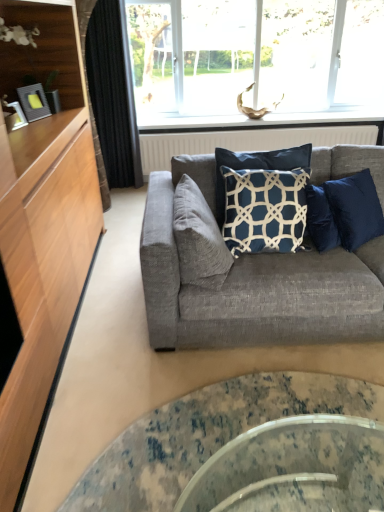
Question: Does black fabric curtain at left appear on the left side of transparent glass window at upper center?

Choices:
 (A) no
 (B) yes

Answer: (B)

Question: From the image's perspective, is black fabric curtain at left located beneath transparent glass window at upper center?

Choices:
 (A) yes
 (B) no

Answer: (A)

Question: From a real-world perspective, is black fabric curtain at left physically above transparent glass window at upper center?

Choices:
 (A) no
 (B) yes

Answer: (A)

Question: Could you tell me if black fabric curtain at left is facing transparent glass window at upper center?

Choices:
 (A) yes
 (B) no

Answer: (B)

Question: Is black fabric curtain at left oriented away from transparent glass window at upper center?

Choices:
 (A) yes
 (B) no

Answer: (B)

Question: Considering the relative positions of black fabric curtain at left and transparent glass window at upper center in the image provided, is black fabric curtain at left to the right of transparent glass window at upper center from the viewer's perspective?

Choices:
 (A) no
 (B) yes

Answer: (A)

Question: Is navy blue fabric pillow at center, which appears as the second pillow when viewed from the left, far from white textured radiator at upper center?

Choices:
 (A) no
 (B) yes

Answer: (B)

Question: Considering the relative sizes of navy blue fabric pillow at center, marked as the first pillow in a right-to-left arrangement, and white textured radiator at upper center in the image provided, is navy blue fabric pillow at center, marked as the first pillow in a right-to-left arrangement, thinner than white textured radiator at upper center?

Choices:
 (A) yes
 (B) no

Answer: (B)

Question: Is navy blue fabric pillow at center, which appears as the second pillow when viewed from the left, next to white textured radiator at upper center and touching it?

Choices:
 (A) yes
 (B) no

Answer: (B)

Question: Is navy blue fabric pillow at center, marked as the first pillow in a right-to-left arrangement, shorter than white textured radiator at upper center?

Choices:
 (A) no
 (B) yes

Answer: (A)

Question: From a real-world perspective, is navy blue fabric pillow at center, marked as the first pillow in a right-to-left arrangement, over white textured radiator at upper center?

Choices:
 (A) no
 (B) yes

Answer: (B)

Question: Does navy blue fabric pillow at center, marked as the first pillow in a right-to-left arrangement, have a smaller size compared to white textured radiator at upper center?

Choices:
 (A) no
 (B) yes

Answer: (B)

Question: Is white textured radiator at upper center closer to camera compared to textured gray couch at center?

Choices:
 (A) yes
 (B) no

Answer: (B)